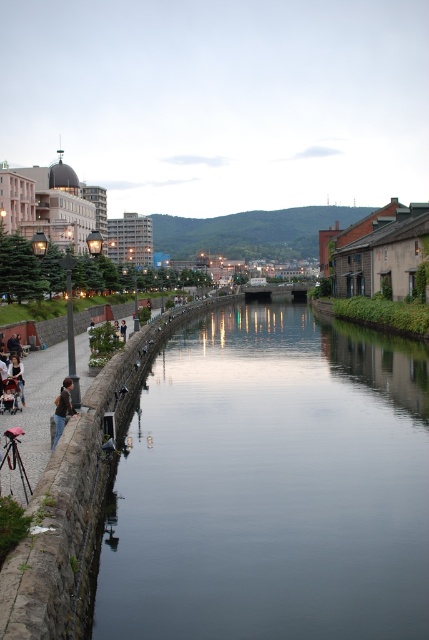
You are a photographer standing at the riverside walkway. You notice two jackets hanging on a lamppost at the lower left corner of your view. The jackets are labeled as the denim jacket at lower left and the dark brown leather jacket at lower left. Which jacket is taller?

The denim jacket at lower left is taller than the dark brown leather jacket at lower left according to the description provided.

Looking at this image, you are standing on the riverside walkway and want to reach the dark brown leather jacket at lower left from the smooth concrete river at center. Given that the jacket is 91.21 feet away, is this distance within a typical walking distance for a person to comfortably walk in 2 minutes?

The distance between the smooth concrete river at center and the dark brown leather jacket at lower left is 91.21 feet. A typical walking speed is about 3 feet per second, so 91.21 feet divided by 3 equals approximately 30.4 seconds. This is well within a 2 minute timeframe, so yes, the distance is comfortably walkable in 2 minutes.